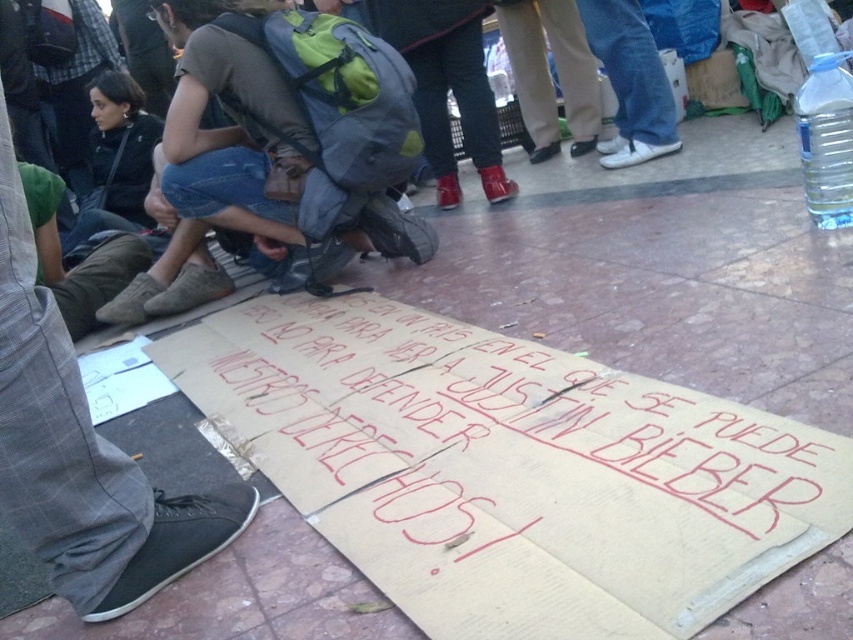
You are a protest organizer who needs to ensure that the cardboard sign at lower center is visible to the crowd. Since the gray fabric backpack at center might block the view, how far apart should they be placed to ensure visibility?

The cardboard sign at lower center and the gray fabric backpack at center should be placed at least 62.64 centimeters apart to ensure visibility, as they are currently 62.64 centimeters apart.

You are a photographer holding a camera and standing near the gray fabric backpack at center. You want to take a photo of the protest sign without moving the backpack. Can you reach the camera to capture the sign in the frame without moving the backpack?

The gray fabric backpack at center and camera are 1.72 meters apart. Since the distance between them is 1.72 meters, you can likely reach the camera to capture the sign in the frame without moving the backpack, as 1.72 meters is a manageable distance for adjusting the camera position while staying near the backpack.

You are a photographer standing at the edge of the protest area. You want to capture a photo that includes both the cardboard sign at lower center and the clear plastic bottle at upper right. Which object should you focus on first to ensure both are in the frame?

The cardboard sign at lower center is closer to the viewer than the clear plastic bottle at upper right. To ensure both are in focus, you should focus on the cardboard sign at lower center first since it is closer, and then adjust to include the clear plastic bottle at upper right in the background.